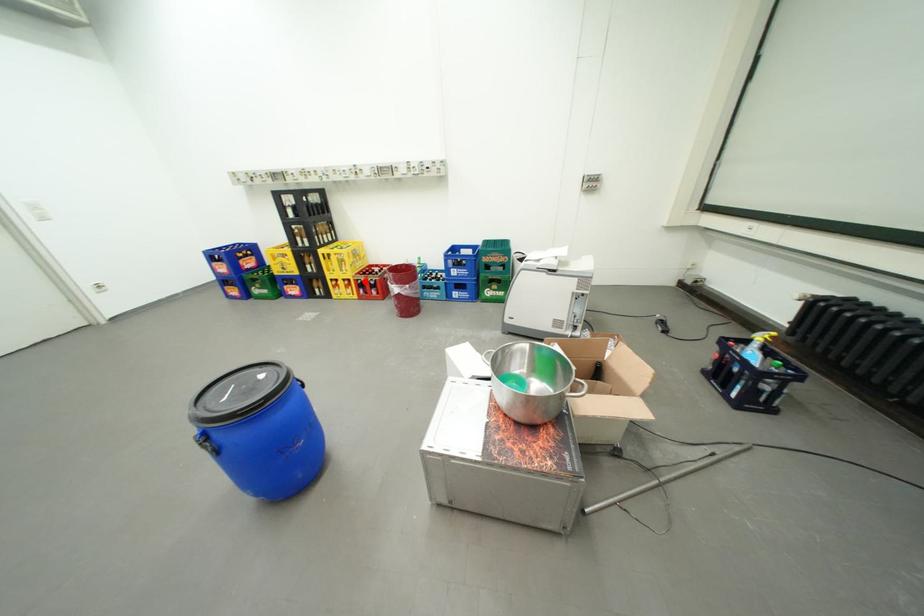
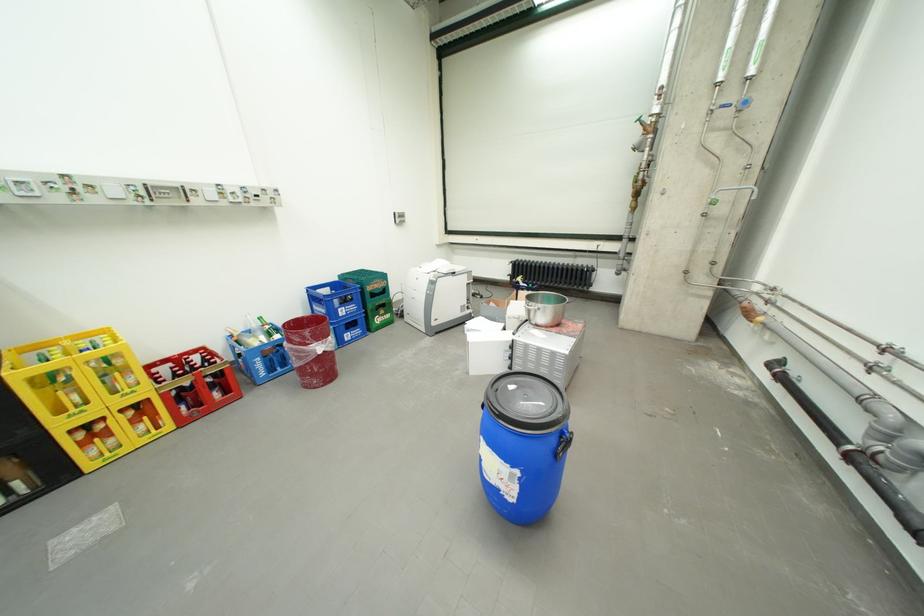
The point at the highlighted location is marked in the first image. Where is the corresponding point in the second image?

(172, 397)